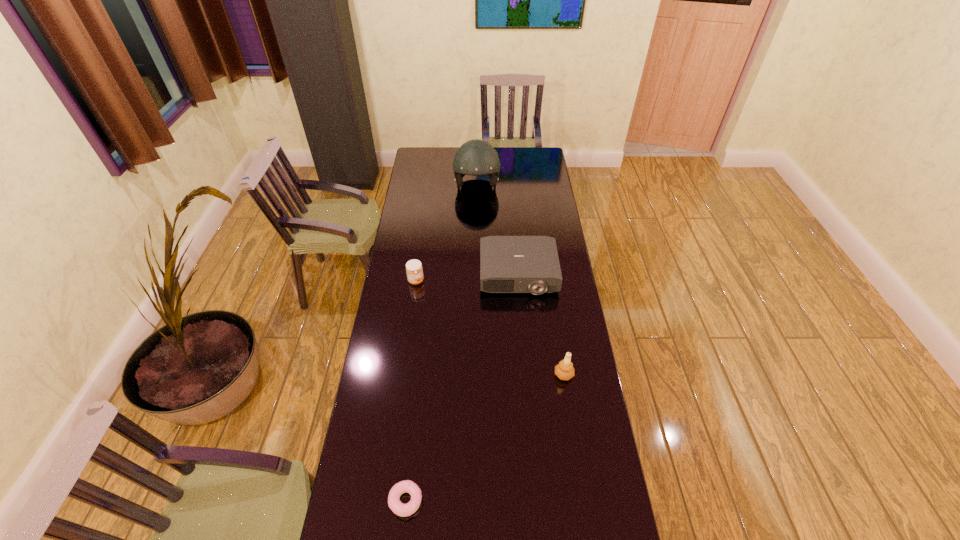
Where is `free space located 0.140m on the front-facing side of the projector`? This screenshot has height=540, width=960. free space located 0.140m on the front-facing side of the projector is located at coordinates (522, 323).

Locate an element on the screen. This screenshot has width=960, height=540. free region located on the front label of the jam is located at coordinates (469, 281).

At what (x,y) coordinates should I click in order to perform the action: click on free location located 0.290m on the back of the nearest object. Please return your answer as a coordinate pair (x, y). Image resolution: width=960 pixels, height=540 pixels. Looking at the image, I should click on (417, 397).

At what (x,y) coordinates should I click in order to perform the action: click on jam situated at the left edge. Please return your answer as a coordinate pair (x, y). Looking at the image, I should click on (414, 269).

Locate an element on the screen. The width and height of the screenshot is (960, 540). doughnut present at the left edge is located at coordinates (406, 486).

Find the location of a particular element. The image size is (960, 540). candle_holder at the right edge is located at coordinates (564, 370).

The width and height of the screenshot is (960, 540). I want to click on projector that is at the right edge, so click(x=508, y=264).

I want to click on vacant space at the far edge of the desktop, so click(506, 154).

Identify the location of vacant position at the left edge of the desktop. The height and width of the screenshot is (540, 960). (418, 253).

Identify the location of vacant space at the right edge of the desktop. The height and width of the screenshot is (540, 960). (553, 303).